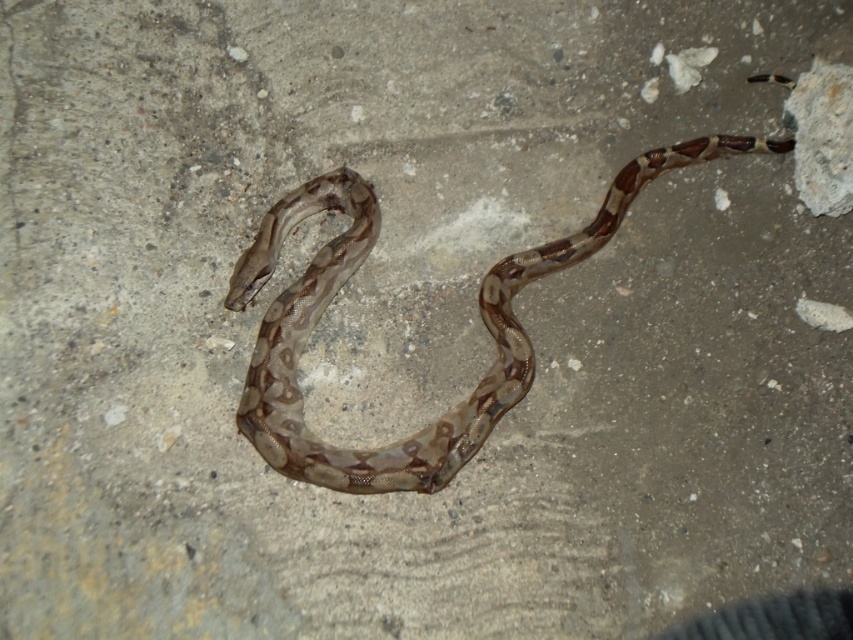
You are a wildlife photographer aiming to capture a closeup of the brown patterned snake at center and the speckled concrete rock at upper right. Based on their positions, which object is closer to the left edge of the frame?

The brown patterned snake at center is positioned on the left side of the speckled concrete rock at upper right, so the brown patterned snake at center is closer to the left edge of the frame.

You are a wildlife photographer who wants to capture the brown patterned snake at center and the speckled concrete rock at upper right in the same frame. Which object should you focus on first if you want to ensure both are in focus, considering their sizes?

The brown patterned snake at center is bigger than the speckled concrete rock at upper right, so you should focus on the brown patterned snake at center first to ensure both are in focus.

You are a wildlife photographer wanting to capture the brown patterned snake at center. The camera you are using has a focus point at coordinate point [479,312]. Will this focus point help you capture the snake?

The point [479,312] corresponds to the brown patterned snake at center, so yes, this focus point will help you capture the snake.